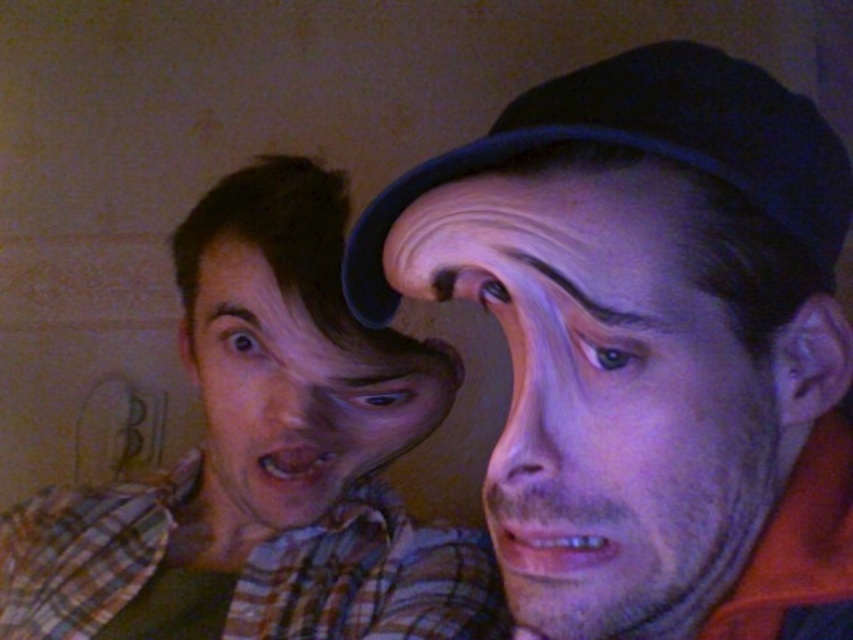
Does plaid shirt at left appear on the left side of matte plaid shirt at left?

Yes, plaid shirt at left is to the left of matte plaid shirt at left.

From the picture: Is the position of plaid shirt at left more distant than that of matte plaid shirt at left?

That is True.

Measure the distance between point (306,371) and camera.

A distance of 22.62 inches exists between point (306,371) and camera.

Locate an element on the screen. The image size is (853, 640). plaid shirt at left is located at coordinates (264, 460).

Which of these two, plaid shirt at left or purple matte face at center, stands taller?

plaid shirt at left is taller.

Who is higher up, plaid shirt at left or purple matte face at center?

Positioned higher is purple matte face at center.

Which is in front, point (198, 349) or point (618, 346)?

Positioned in front is point (618, 346).

This screenshot has height=640, width=853. Find the location of `plaid shirt at left`. plaid shirt at left is located at coordinates (264, 460).

Who is lower down, purple matte face at center or matte plaid shirt at left?

matte plaid shirt at left

Does purple matte face at center appear under matte plaid shirt at left?

No.

Is point (628, 170) farther from camera compared to point (258, 502)?

No, it is in front of (258, 502).

Where is `purple matte face at center`? This screenshot has height=640, width=853. purple matte face at center is located at coordinates (606, 396).